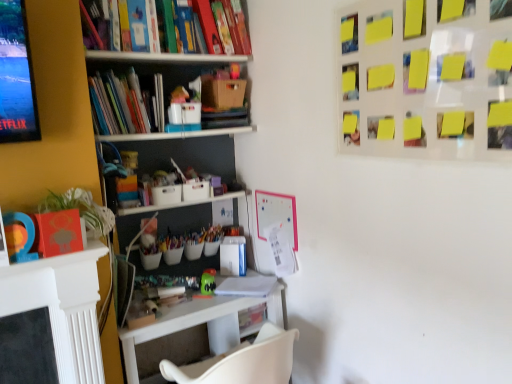
Locate an element on the screen. This screenshot has width=512, height=384. vacant region above white plastic table at lower left (from a real-world perspective) is located at coordinates (205, 292).